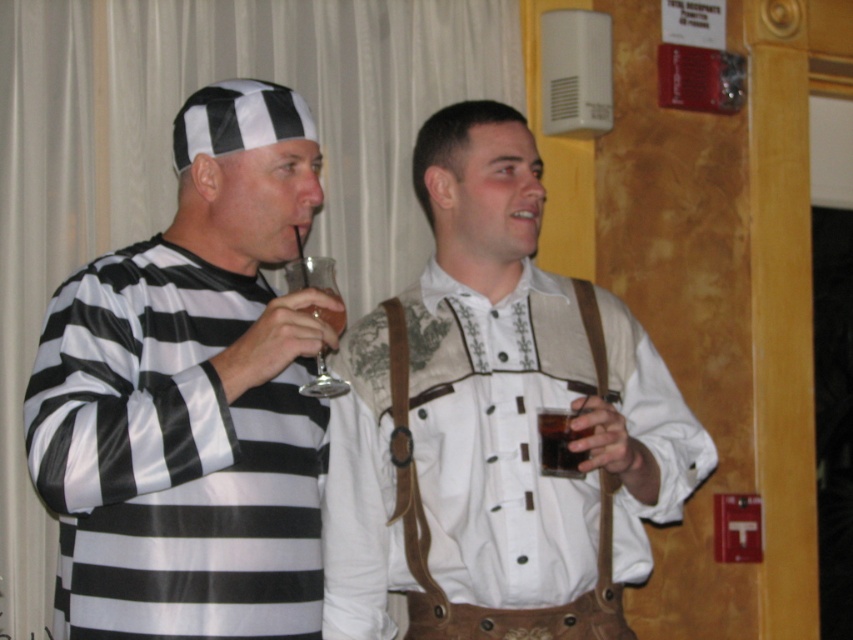
You are at a party and want to pour the dark brown liquid at right into the clear glass wine glass at center. Can you do this without spilling?

The clear glass wine glass at center is positioned on the left side of dark brown liquid at right, so you can pour the dark brown liquid at right into the clear glass wine glass at center without spilling as long as you carefully move them towards each other.

You are a photographer at the event and need to capture a closeup of the dark brown liquid at right. The camera can only focus on objects within a 0.1 unit radius around the point specified. Is the point at coordinates point [560,442] the correct location to focus on?

Yes, the point [560,442] corresponds to the dark brown liquid at right, so focusing there will capture it.